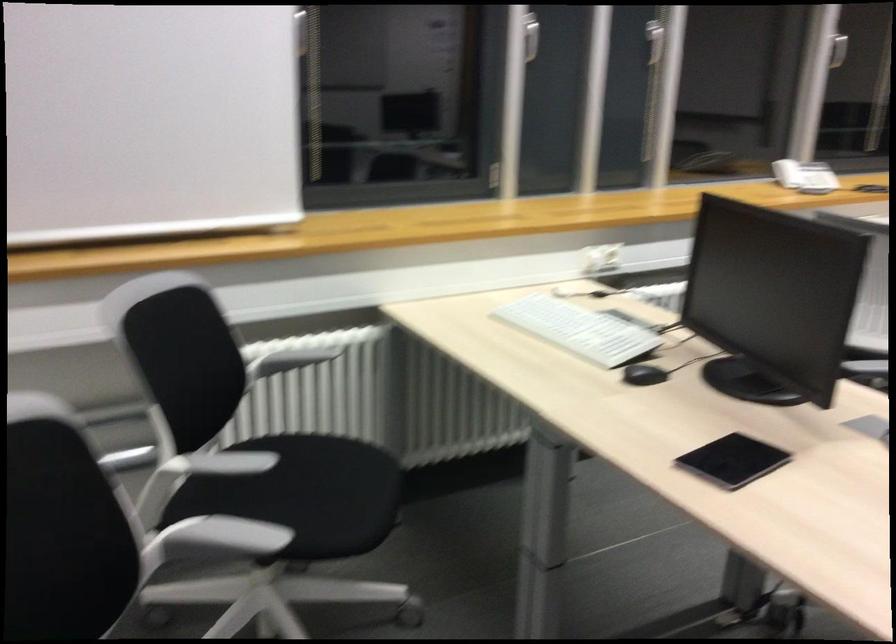
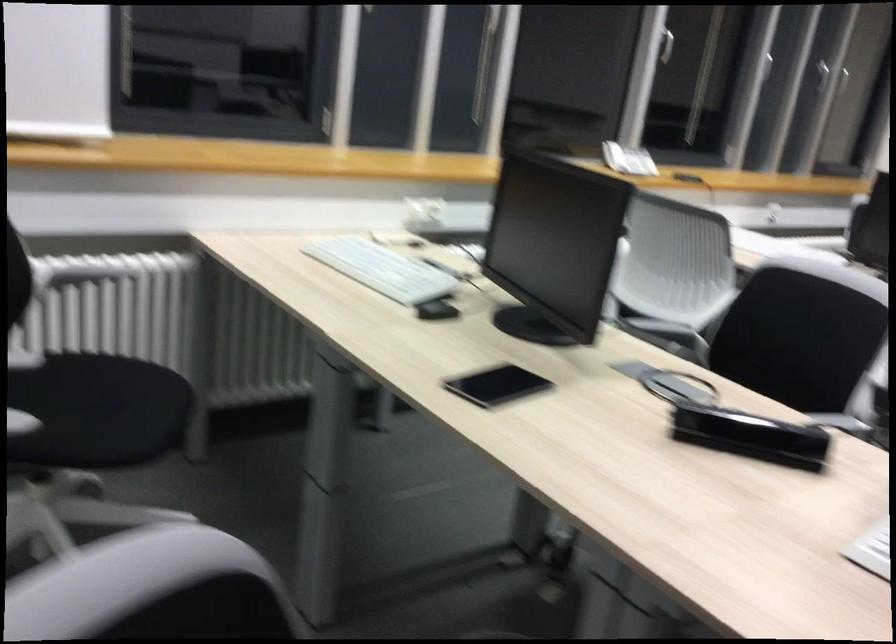
Where in the second image is the point corresponding to (x=321, y=493) from the first image?

(101, 410)